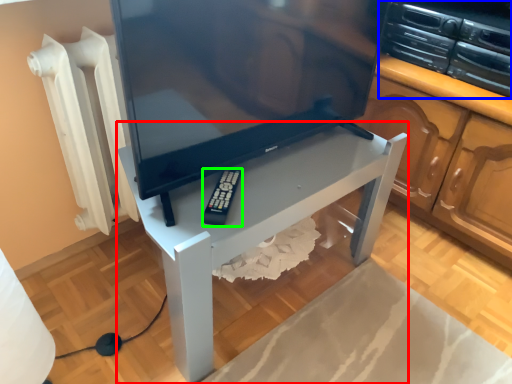
Question: Estimate the real-world distances between objects in this image. Which object is farther from furniture (highlighted by a red box), appliance (highlighted by a blue box) or equipment (highlighted by a green box)?

Choices:
 (A) appliance
 (B) equipment

Answer: (A)